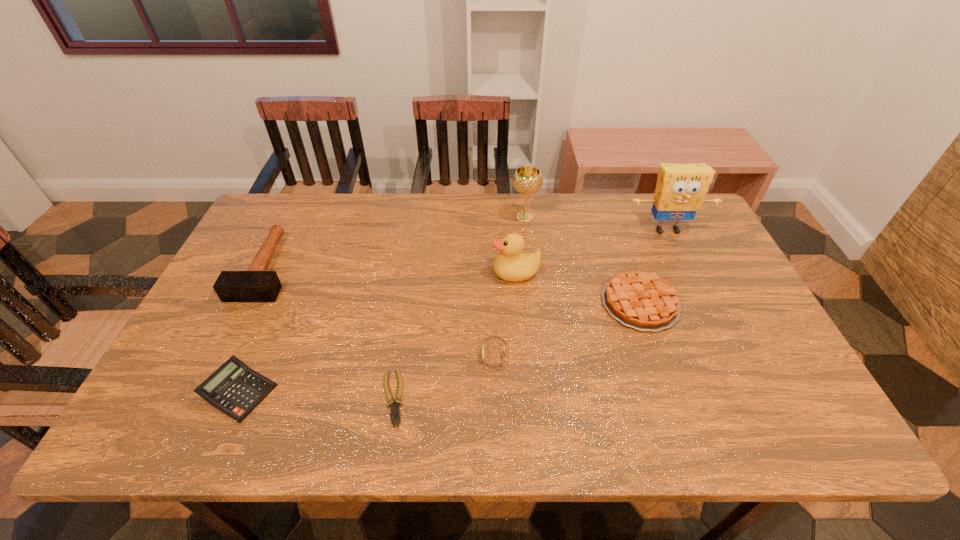
At what (x,y) coordinates should I click in order to perform the action: click on object present at the near left corner. Please return your answer as a coordinate pair (x, y). Looking at the image, I should click on (235, 389).

Find the location of a particular element. object positioned at the far right corner is located at coordinates (680, 190).

In the image, there is a desktop. Identify the location of vacant space at the far edge. (554, 234).

Locate an element on the screen. vacant position at the left edge of the desktop is located at coordinates (168, 381).

This screenshot has height=540, width=960. I want to click on free space at the right edge, so click(x=691, y=298).

At what (x,y) coordinates should I click in order to perform the action: click on free point between the calculator and the chalice. Please return your answer as a coordinate pair (x, y). The width and height of the screenshot is (960, 540). Looking at the image, I should click on (381, 305).

At what (x,y) coordinates should I click in order to perform the action: click on free space between the sponge and the watch. Please return your answer as a coordinate pair (x, y). Looking at the image, I should click on (581, 293).

Where is `vacant area that lies between the duck and the watch`? The width and height of the screenshot is (960, 540). vacant area that lies between the duck and the watch is located at coordinates (505, 314).

I want to click on vacant point located between the watch and the pie, so click(567, 329).

Find the location of a particular element. Image resolution: width=960 pixels, height=540 pixels. free space that is in between the watch and the fifth shortest object is located at coordinates (380, 311).